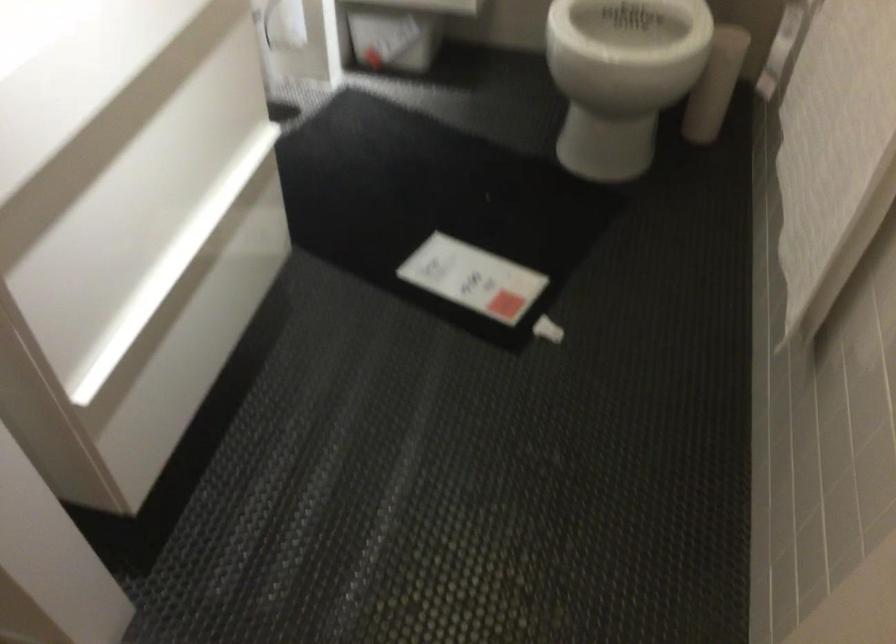
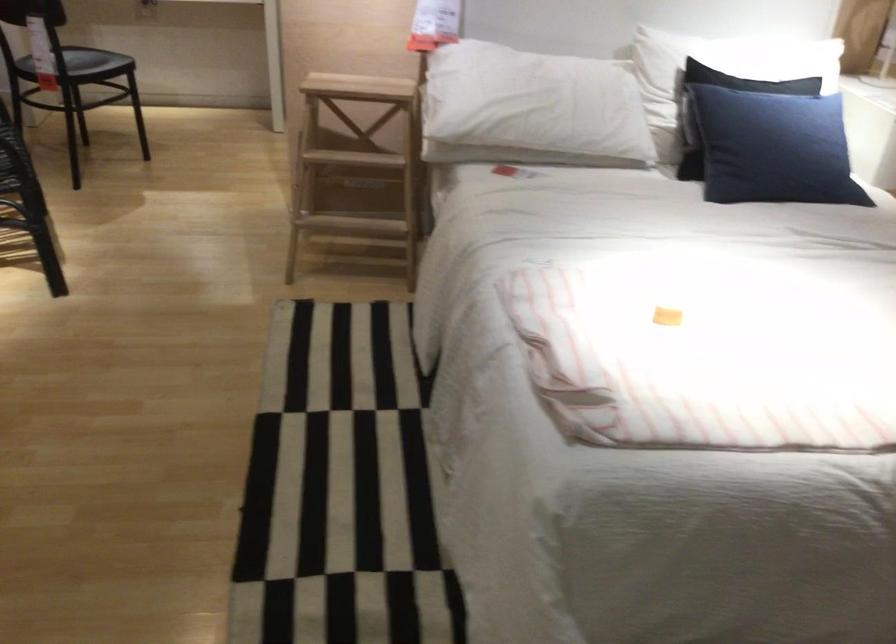
Question: I am providing you with two images of the same scene from different viewpoints. Please identify which objects are invisible in image2.

Choices:
 (A) white paper tag
 (B) orange tipped hook
 (C) white pillow
 (D) striped folded blanket

Answer: (A)